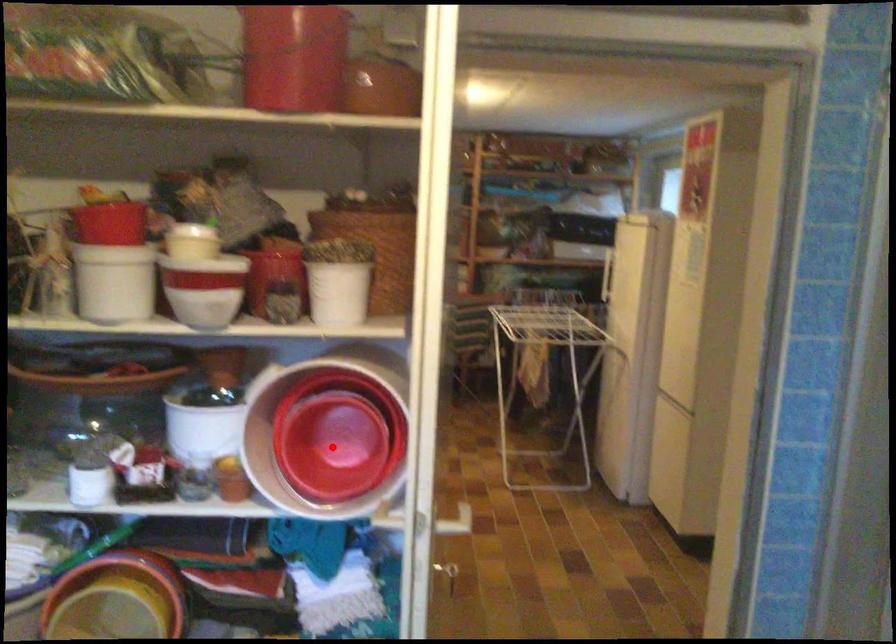
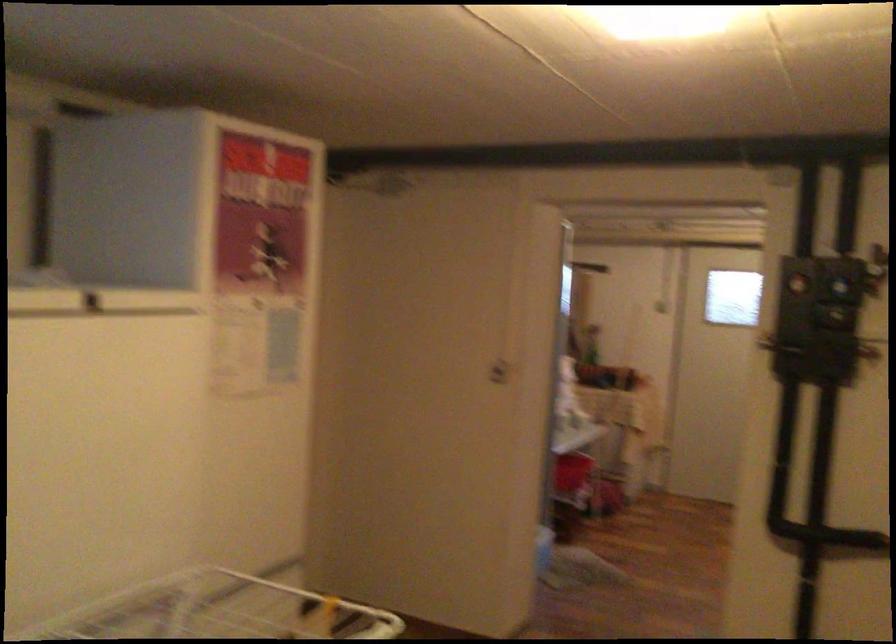
Question: I am providing you with two images of the same scene from different viewpoints. A red point is marked on the first image. Is the red point's position out of view in image 2?

Choices:
 (A) Yes
 (B) No

Answer: (A)